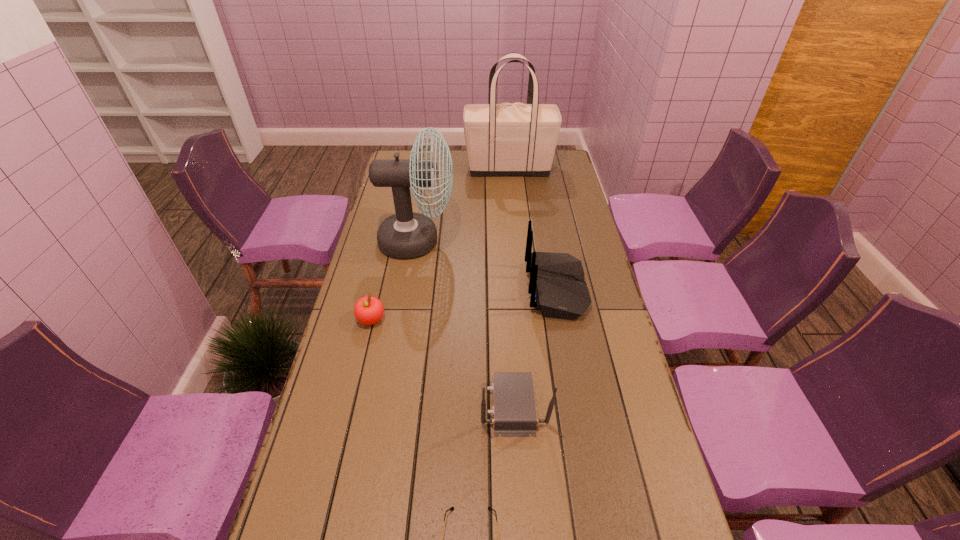
Locate an element on the screen. This screenshot has height=540, width=960. free location located 0.090m on the back of the nearer router to connect cables is located at coordinates (447, 404).

Locate an element on the screen. free space located 0.180m on the back of the nearer router to connect cables is located at coordinates [414, 404].

You are a GUI agent. You are given a task and a screenshot of the screen. Output one action in this format:
    pyautogui.click(x=<x>, y=<y>)
    Task: Click on the vacant space situated 0.400m on the back of the farther router
    
    Given the screenshot: What is the action you would take?
    pyautogui.click(x=409, y=289)

In order to click on free space located on the back of the farther router in this screenshot , I will do `click(456, 289)`.

What are the coordinates of `vacant space located 0.180m on the back of the farther router` in the screenshot? It's located at (473, 289).

This screenshot has width=960, height=540. Identify the location of vacant space located on the right of the apple. (465, 320).

I want to click on object located in the far edge section of the desktop, so click(517, 139).

This screenshot has width=960, height=540. What are the coordinates of `fan that is at the left edge` in the screenshot? It's located at (406, 234).

I want to click on apple positioned at the left edge, so click(368, 310).

Locate an element on the screen. This screenshot has height=540, width=960. shopping bag at the right edge is located at coordinates (517, 139).